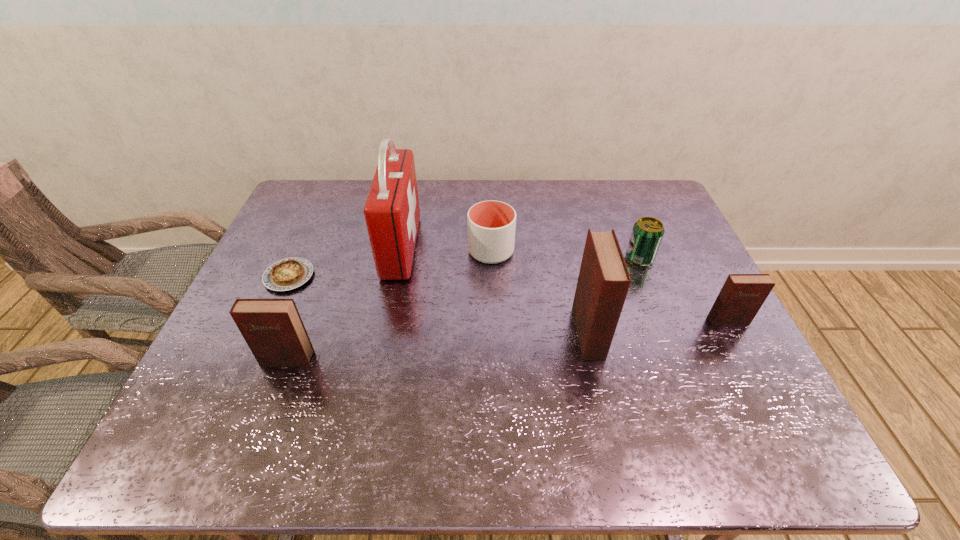
The width and height of the screenshot is (960, 540). Identify the location of the leftmost diary. (272, 328).

The height and width of the screenshot is (540, 960). In order to click on the second tallest diary in this screenshot , I will do pos(272,328).

Locate an element on the screen. The height and width of the screenshot is (540, 960). the second diary from left to right is located at coordinates (603, 283).

At what (x,y) coordinates should I click in order to perform the action: click on the tallest diary. Please return your answer as a coordinate pair (x, y). Image resolution: width=960 pixels, height=540 pixels. Looking at the image, I should click on 603,283.

I want to click on the rightmost object, so click(742, 295).

The width and height of the screenshot is (960, 540). Identify the location of the shortest diary. (742, 295).

Find the location of `the third object from left to right`. the third object from left to right is located at coordinates pyautogui.click(x=392, y=213).

At what (x,y) coordinates should I click in order to perform the action: click on the first-aid kit. Please return your answer as a coordinate pair (x, y). Image resolution: width=960 pixels, height=540 pixels. Looking at the image, I should click on (392, 213).

The image size is (960, 540). Find the location of `the fourth object from right to left`. the fourth object from right to left is located at coordinates (491, 224).

Locate an element on the screen. This screenshot has width=960, height=540. quiche is located at coordinates (287, 274).